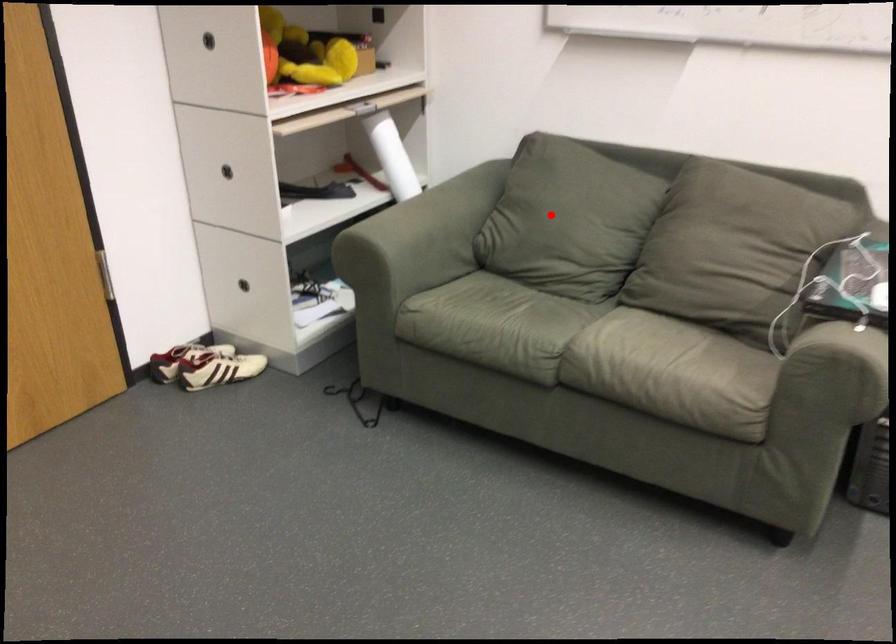
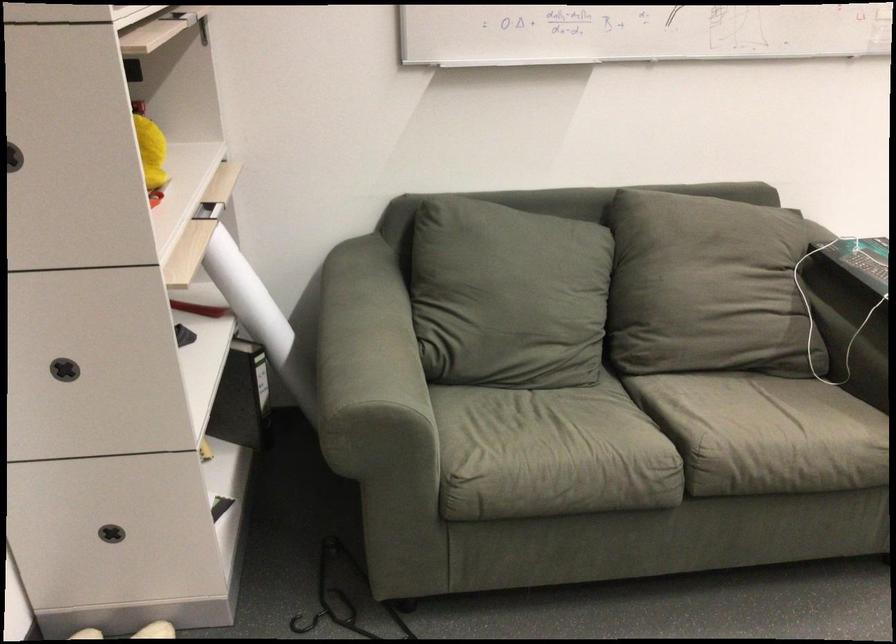
Question: I am providing you with two images of the same scene from different viewpoints. Given a red point in image1, look at the same physical point in image2. Is it:

Choices:
 (A) Closer to the viewpoint
 (B) Farther from the viewpoint

Answer: (A)